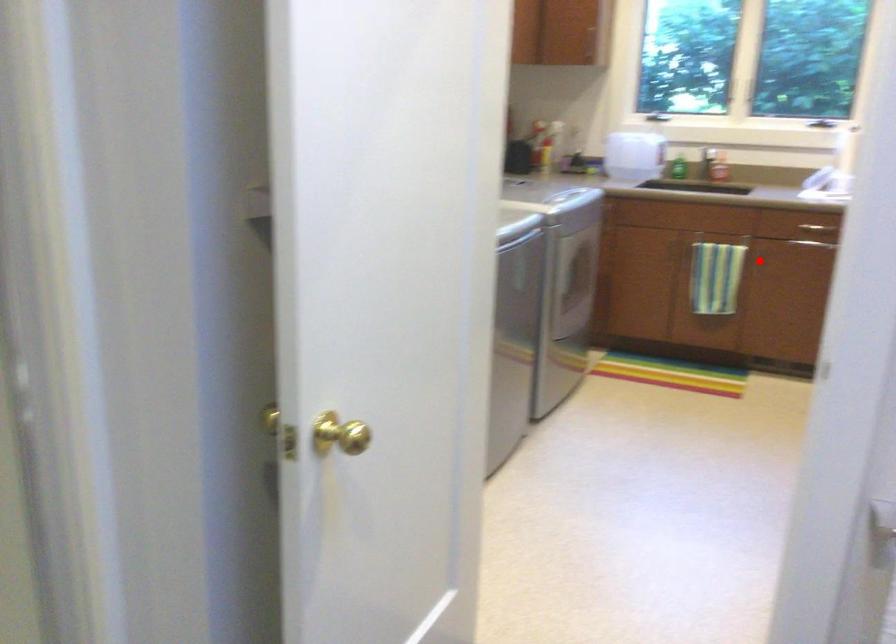
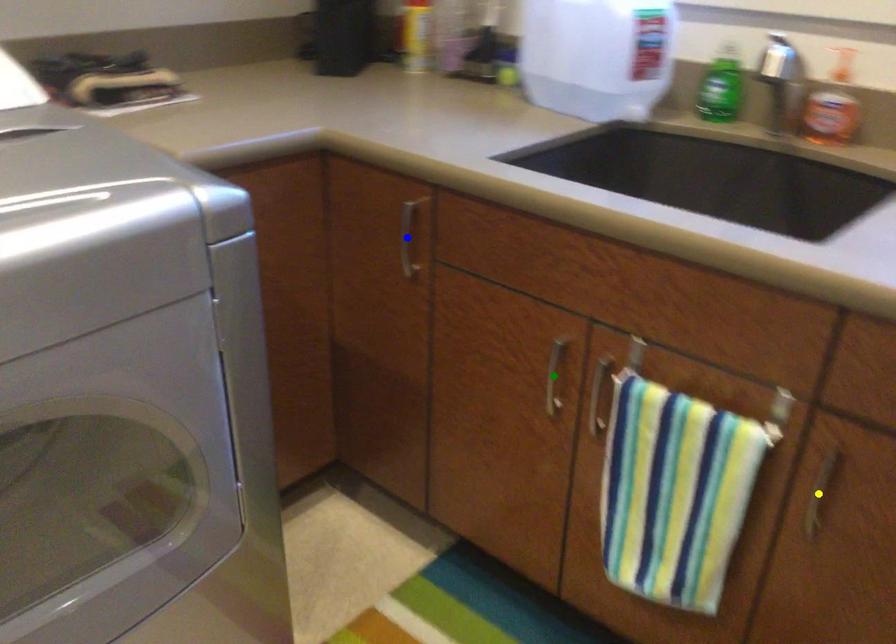
Question: I am providing you with two images of the same scene from different viewpoints. A red point is marked on the first image. You are given multiple points on the second image. Which spot in image 2 lines up with the point in image 1?

Choices:
 (A) green point
 (B) blue point
 (C) yellow point

Answer: (C)